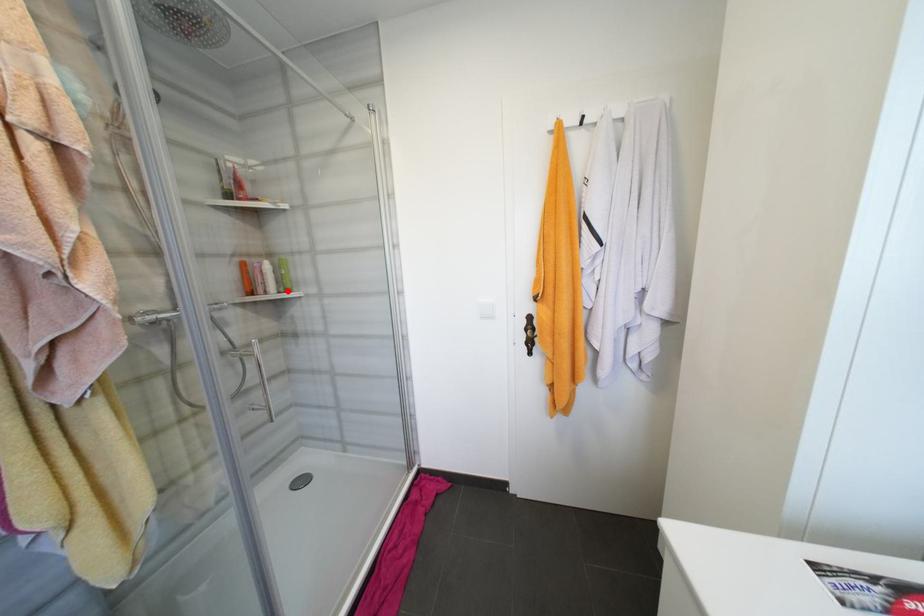
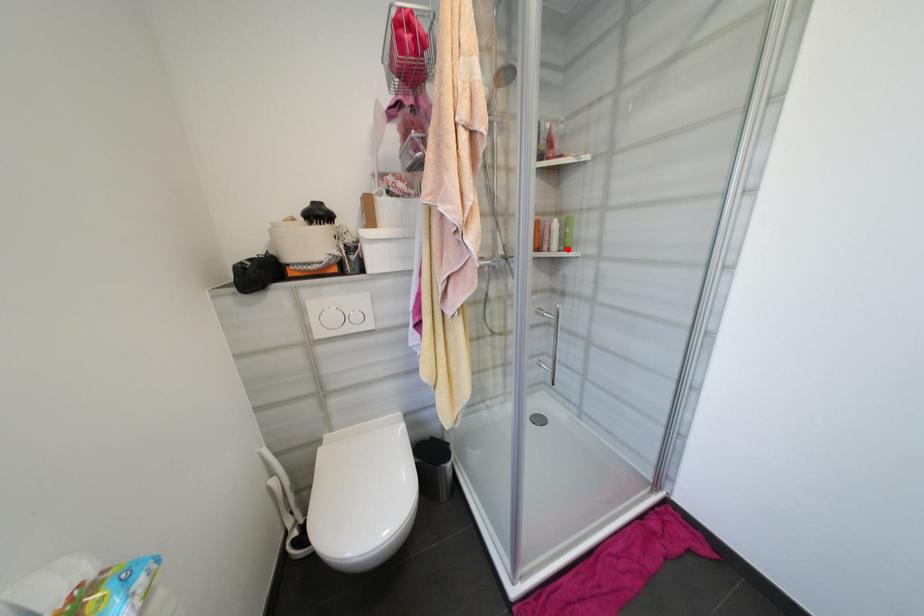
I am providing you with two images of the same scene from different viewpoints. A red point is marked on the first image and another point is marked on the second image. Are the points marked in image1 and image2 representing the same 3D position?

Yes